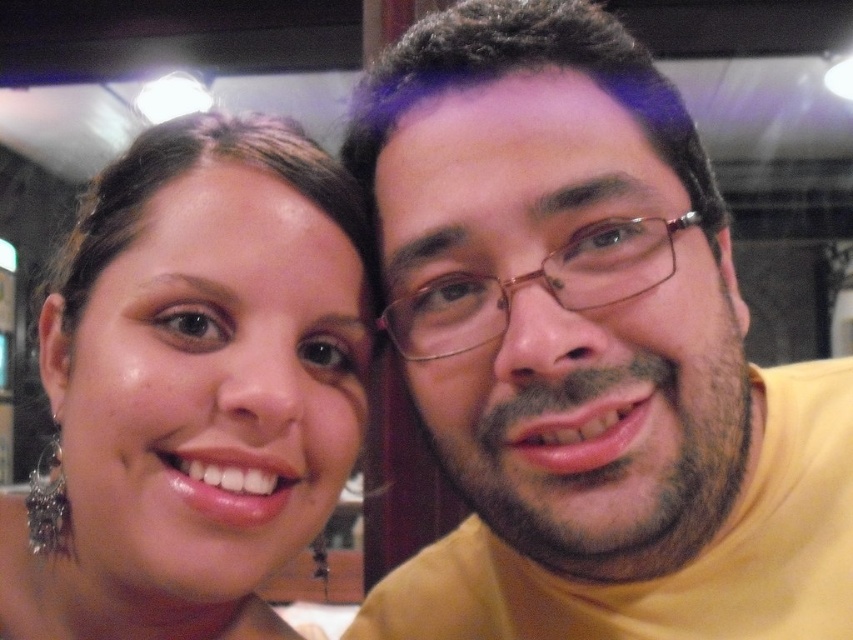
Find the location of a particular element. yellow matte shirt at right is located at coordinates (585, 349).

Which is below, yellow matte shirt at right or matte gold earring at left?

Positioned lower is matte gold earring at left.

Between point (788, 397) and point (270, 339), which one is positioned in front?

Point (270, 339) is more forward.

Find the location of a particular element. yellow matte shirt at right is located at coordinates (585, 349).